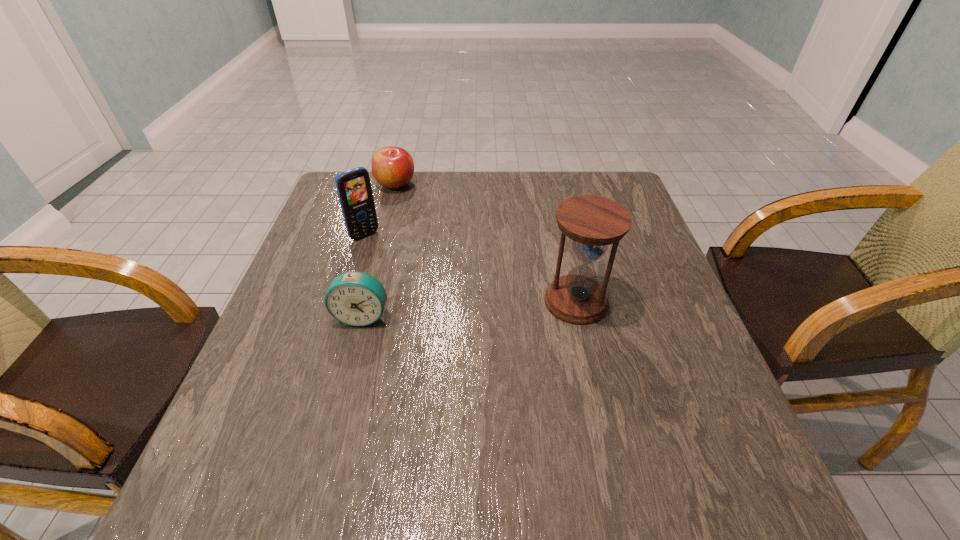
Identify the location of vacant space at the left edge of the desktop. The image size is (960, 540). 306,348.

In the image, there is a desktop. Where is `free region at the right edge`? free region at the right edge is located at coordinates (637, 328).

Image resolution: width=960 pixels, height=540 pixels. Identify the location of free space at the far left corner. (334, 190).

I want to click on vacant area at the near left corner of the desktop, so click(x=307, y=409).

Where is `free space at the far right corner`? The image size is (960, 540). free space at the far right corner is located at coordinates (603, 184).

Locate an element on the screen. The height and width of the screenshot is (540, 960). vacant area that lies between the second farthest object and the apple is located at coordinates (380, 210).

What are the coordinates of `vacant area that lies between the farthest object and the alarm clock` in the screenshot? It's located at click(x=379, y=251).

This screenshot has height=540, width=960. I want to click on free area in between the second farthest object and the hourglass, so click(x=470, y=268).

Find the location of a particular element. unoccupied area between the cellular telephone and the rightmost object is located at coordinates (470, 268).

At what (x,y) coordinates should I click in order to perform the action: click on blank region between the hourglass and the apple. Please return your answer as a coordinate pair (x, y). This screenshot has height=540, width=960. Looking at the image, I should click on (486, 243).